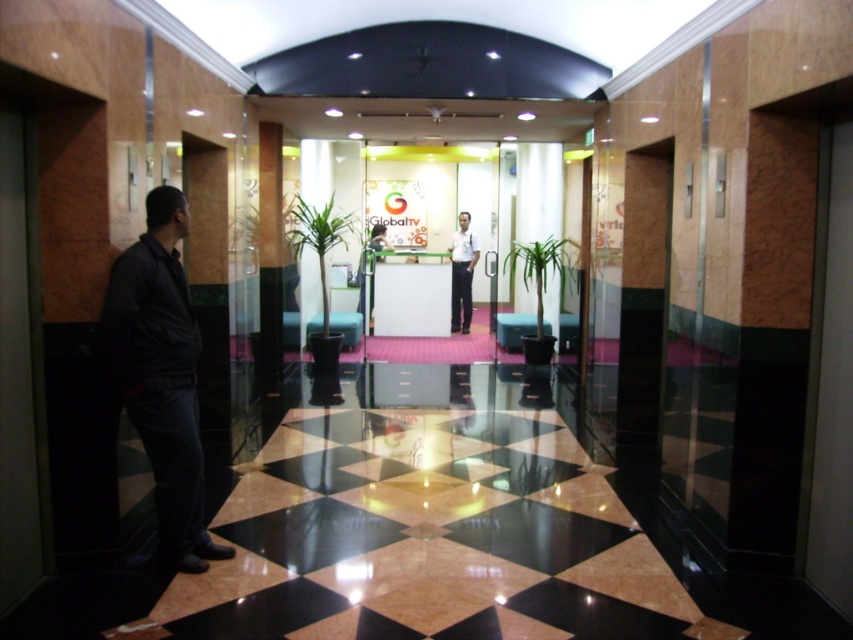
Can you confirm if dark gray jacket at left is taller than matte black shirt at center?

Yes.

Between point (126, 369) and point (364, 284), which one is positioned in front?

Positioned in front is point (126, 369).

What are the coordinates of `dark gray jacket at left` in the screenshot? It's located at (161, 376).

The width and height of the screenshot is (853, 640). What do you see at coordinates (161, 376) in the screenshot?
I see `dark gray jacket at left` at bounding box center [161, 376].

In the scene shown: Can you confirm if dark gray jacket at left is positioned to the right of white shirt at center?

In fact, dark gray jacket at left is to the left of white shirt at center.

What are the coordinates of `dark gray jacket at left` in the screenshot? It's located at (161, 376).

The image size is (853, 640). I want to click on dark gray jacket at left, so click(161, 376).

Can you confirm if white shirt at center is bigger than matte black shirt at center?

No.

Can you confirm if white shirt at center is thinner than matte black shirt at center?

Yes.

Identify the location of white shirt at center. This screenshot has height=640, width=853. tap(462, 273).

You are a GUI agent. You are given a task and a screenshot of the screen. Output one action in this format:
    pyautogui.click(x=<x>, y=<y>)
    Task: Click on the white shirt at center
    The image size is (853, 640).
    Given the screenshot: What is the action you would take?
    pyautogui.click(x=462, y=273)